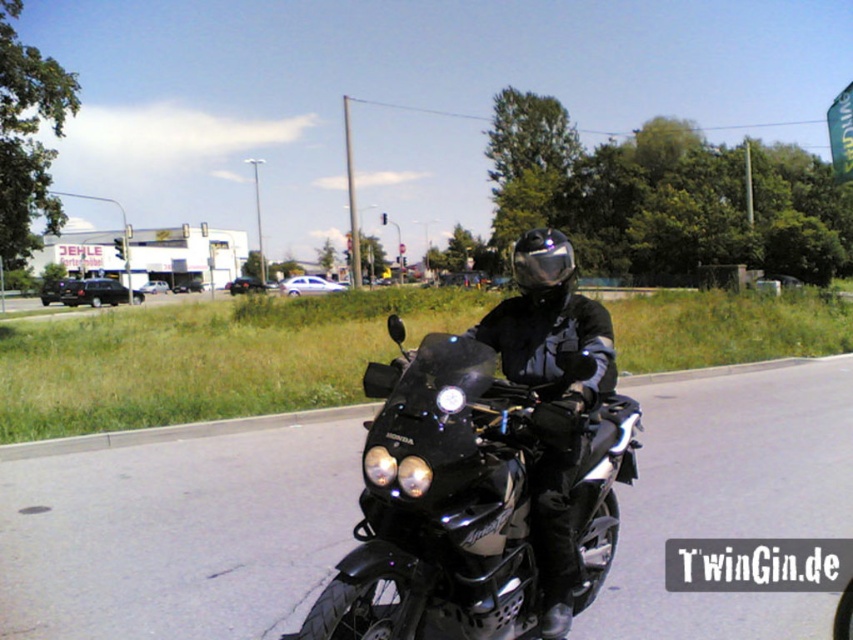
Question: Which object appears closest to the camera in this image?

Choices:
 (A) black matte motorcycle at center
 (B) shiny black helmet at center

Answer: (A)

Question: Which point appears closest to the camera in this image?

Choices:
 (A) (397, 490)
 (B) (537, 284)

Answer: (A)

Question: Among these objects, which one is nearest to the camera?

Choices:
 (A) black matte motorcycle at center
 (B) shiny black helmet at center

Answer: (A)

Question: Observing the image, what is the correct spatial positioning of black matte motorcycle at center in reference to shiny black helmet at center?

Choices:
 (A) above
 (B) below

Answer: (B)

Question: Does black matte motorcycle at center have a greater width compared to shiny black helmet at center?

Choices:
 (A) no
 (B) yes

Answer: (A)

Question: Does black matte motorcycle at center appear under shiny black helmet at center?

Choices:
 (A) no
 (B) yes

Answer: (B)